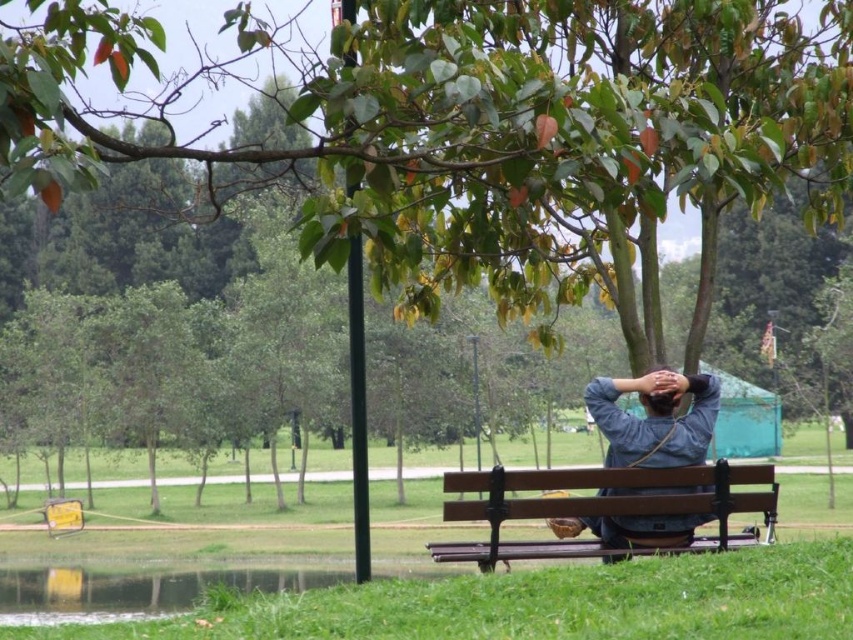
Question: Which point appears farthest from the camera in this image?

Choices:
 (A) (683, 381)
 (B) (57, 616)
 (C) (701, 429)

Answer: (B)

Question: Among these points, which one is nearest to the camera?

Choices:
 (A) (689, 376)
 (B) (28, 593)
 (C) (587, 504)

Answer: (C)

Question: Based on their relative distances, which object is farther from the green grassy pond at lower left?

Choices:
 (A) denim shirt at center
 (B) brown matte head at center
 (C) brown wooden bench at center

Answer: (A)

Question: In this image, where is brown wooden bench at center located relative to green grassy pond at lower left?

Choices:
 (A) right
 (B) left

Answer: (A)

Question: Is brown wooden bench at center in front of brown matte head at center?

Choices:
 (A) yes
 (B) no

Answer: (A)

Question: Is green grassy pond at lower left positioned at the back of denim shirt at center?

Choices:
 (A) no
 (B) yes

Answer: (B)